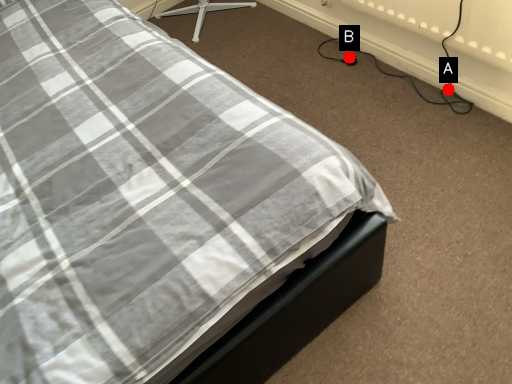
Question: Two points are circled on the image, labeled by A and B beside each circle. Which of the following is the farthest from the observer?

Choices:
 (A) A is further
 (B) B is further

Answer: (B)